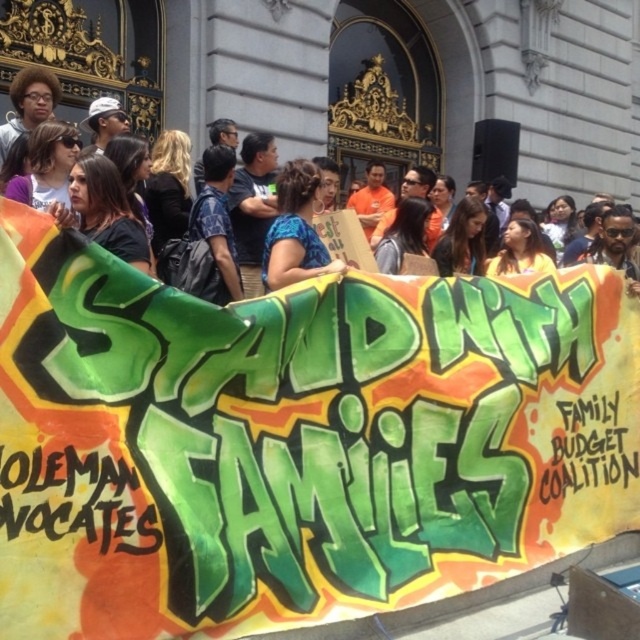
You are a photographer at the protest scene. You want to take a photo focusing on the banner. There are two points marked on your viewfinder at coordinates point (134, 280) and point (280, 280). Which point is closer to the camera?

Point (134, 280) is closer to the camera than point (280, 280).